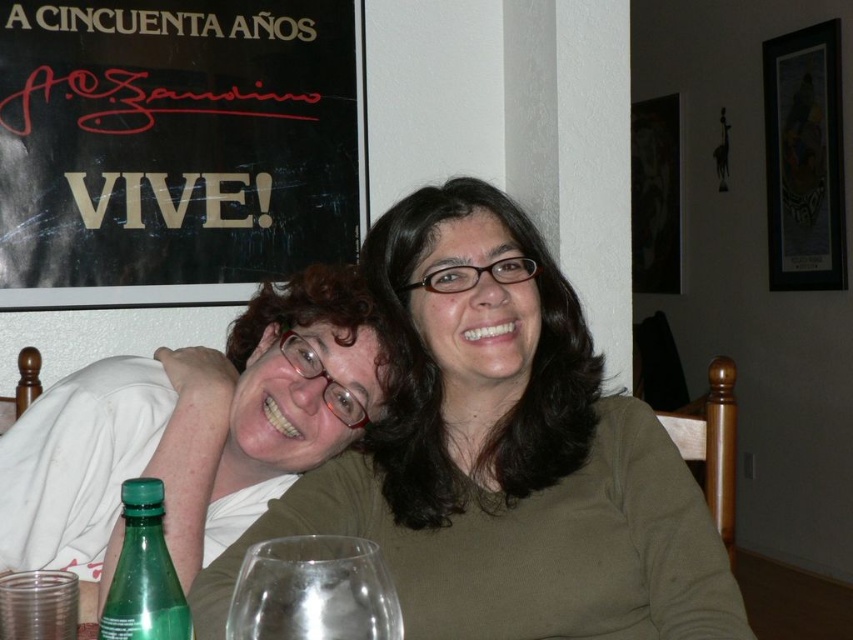
In the scene shown: You are a guest at a dinner party and see the black paper at upper left and the transparent glass at lower center on the table. Which object is covering the other?

The black paper at upper left is positioned over the transparent glass at lower center, so it is covering the glass.

In the scene shown: You are a photographer who wants to ensure that the black paper at upper left and the matte white shirt at left are both clearly visible in the photo. Given their sizes, which object might require more careful framing to avoid being too small in the shot?

The matte white shirt at left is smaller than the black paper at upper left, so it might require more careful framing to ensure it remains visible in the photo.